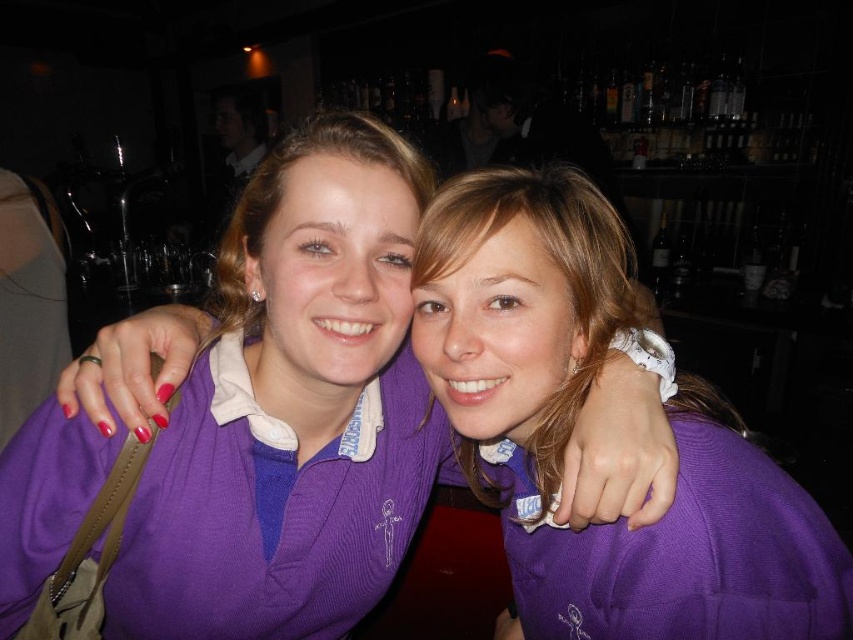
From the picture: Can you confirm if purple jersey at center is positioned below purple ribbed sweater at center?

Indeed, purple jersey at center is positioned under purple ribbed sweater at center.

Does purple jersey at center have a greater height compared to purple ribbed sweater at center?

Yes.

Who is more forward, (258, 522) or (531, 209)?

Positioned in front is point (531, 209).

Identify the location of purple jersey at center. The height and width of the screenshot is (640, 853). (292, 410).